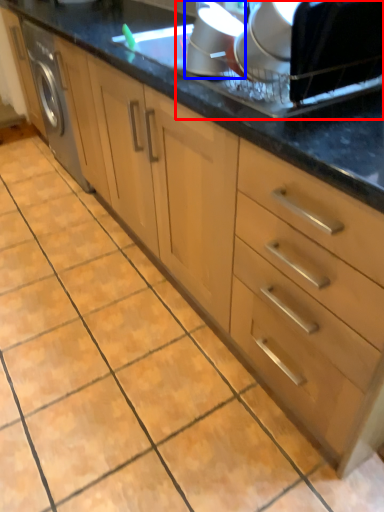
Question: Which point is closer to the camera, appliance (highlighted by a red box) or appliance (highlighted by a blue box)?

Choices:
 (A) appliance
 (B) appliance

Answer: (A)